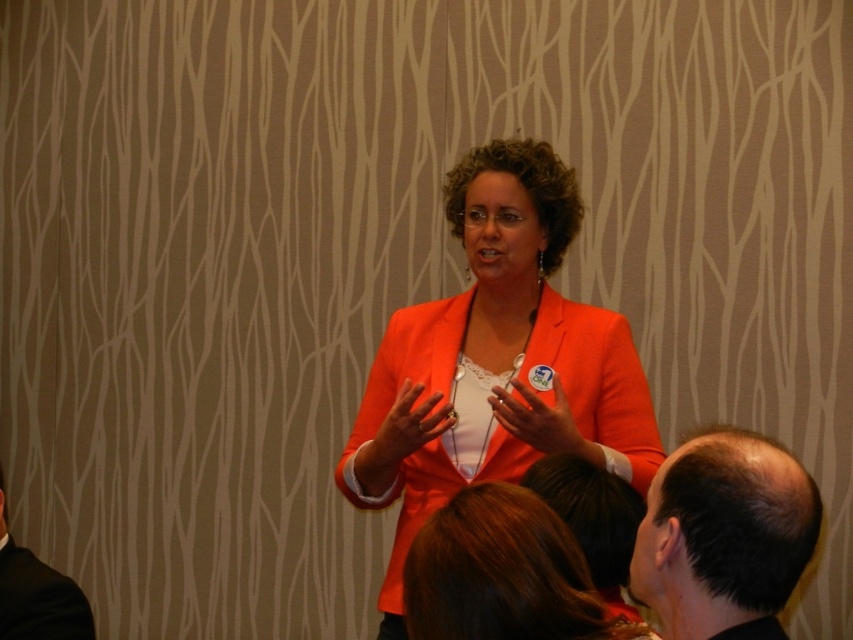
Does orange matte blazer at center have a greater width compared to dark brown hair at lower right?

Indeed, orange matte blazer at center has a greater width compared to dark brown hair at lower right.

Between orange matte blazer at center and dark brown hair at lower right, which one is positioned higher?

orange matte blazer at center is higher up.

Does point (529, 257) lie behind point (762, 512)?

That is True.

Where is `orange matte blazer at center`? This screenshot has width=853, height=640. orange matte blazer at center is located at coordinates (498, 353).

Is dark brown hair at lower right to the left of black suit at lower left from the viewer's perspective?

No, dark brown hair at lower right is not to the left of black suit at lower left.

What do you see at coordinates (724, 536) in the screenshot?
I see `dark brown hair at lower right` at bounding box center [724, 536].

Find the location of a particular element. The image size is (853, 640). dark brown hair at lower right is located at coordinates (724, 536).

Which is above, shiny brown hair at lower center or orange matte jacket at center?

orange matte jacket at center is above.

Is shiny brown hair at lower center taller than orange matte jacket at center?

Correct, shiny brown hair at lower center is much taller as orange matte jacket at center.

I want to click on shiny brown hair at lower center, so click(505, 573).